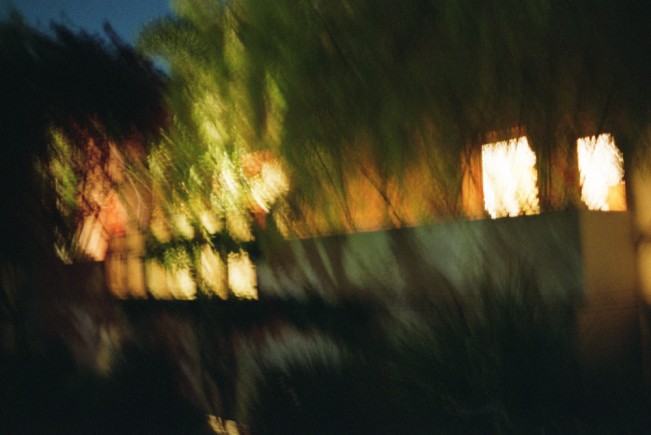
Locate an element on the screen. space between windows is located at coordinates (556, 175).